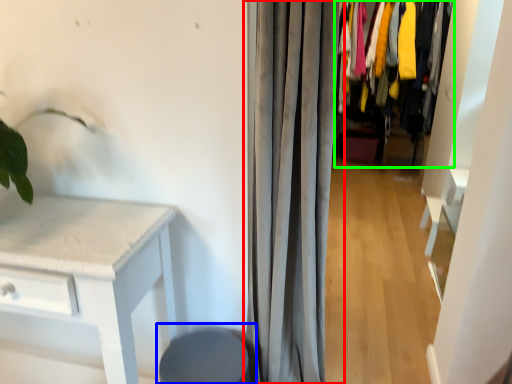
Question: Estimate the real-world distances between objects in this image. Which object is farther from curtain (highlighted by a red box), swivel chair (highlighted by a blue box) or closet (highlighted by a green box)?

Choices:
 (A) swivel chair
 (B) closet

Answer: (B)